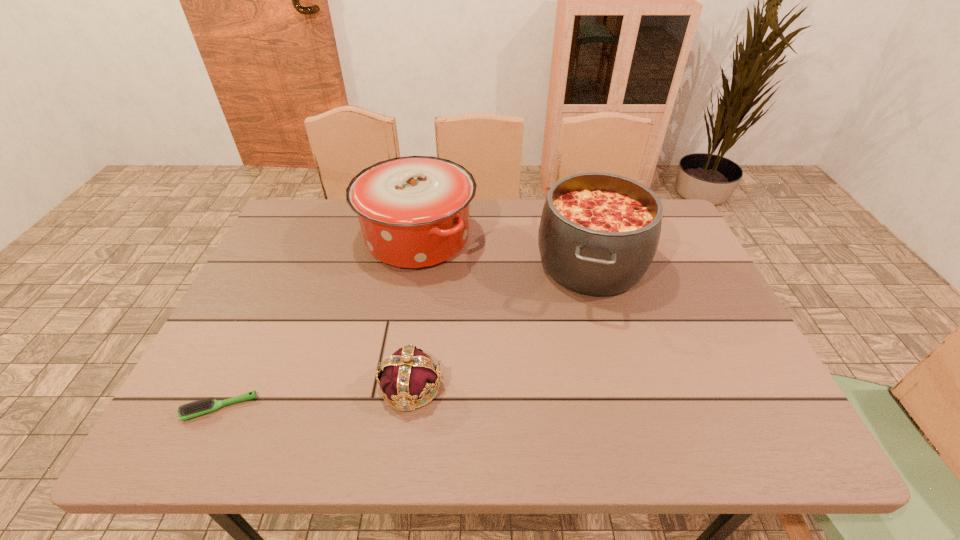
Locate an element on the screen. This screenshot has height=540, width=960. free spot between the rightmost object and the shortest object is located at coordinates (405, 335).

Image resolution: width=960 pixels, height=540 pixels. Identify the location of free point between the left casserole and the hairbrush. (319, 323).

At what (x,y) coordinates should I click in order to perform the action: click on free spot between the right casserole and the left casserole. Please return your answer as a coordinate pair (x, y). The height and width of the screenshot is (540, 960). Looking at the image, I should click on (504, 251).

In order to click on blank region between the second shortest object and the rightmost object in this screenshot , I will do `click(501, 325)`.

This screenshot has height=540, width=960. I want to click on vacant space that is in between the third tallest object and the left casserole, so click(415, 312).

At what (x,y) coordinates should I click in order to perform the action: click on free point between the crown and the right casserole. Please return your answer as a coordinate pair (x, y). The height and width of the screenshot is (540, 960). Looking at the image, I should click on (501, 325).

This screenshot has height=540, width=960. I want to click on vacant point located between the third tallest object and the rightmost object, so click(501, 325).

Where is `free space between the hairbrush and the right casserole`? The height and width of the screenshot is (540, 960). free space between the hairbrush and the right casserole is located at coordinates (405, 335).

Where is `vacant area that lies between the left casserole and the shortest object`? vacant area that lies between the left casserole and the shortest object is located at coordinates (319, 323).

Find the location of a particular element. This screenshot has height=540, width=960. vacant area between the leftmost object and the third tallest object is located at coordinates (316, 397).